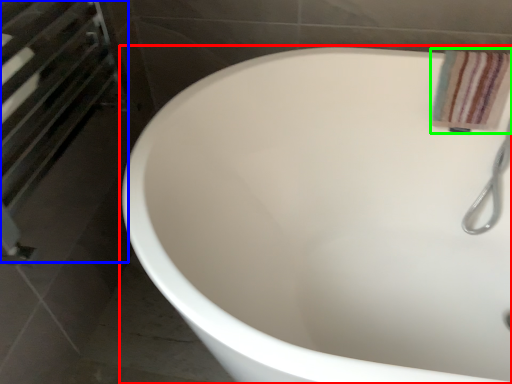
Question: Which object is positioned closest to bathtub (highlighted by a red box)? Select from screen door (highlighted by a blue box) and bath towel (highlighted by a green box).

Choices:
 (A) screen door
 (B) bath towel

Answer: (B)